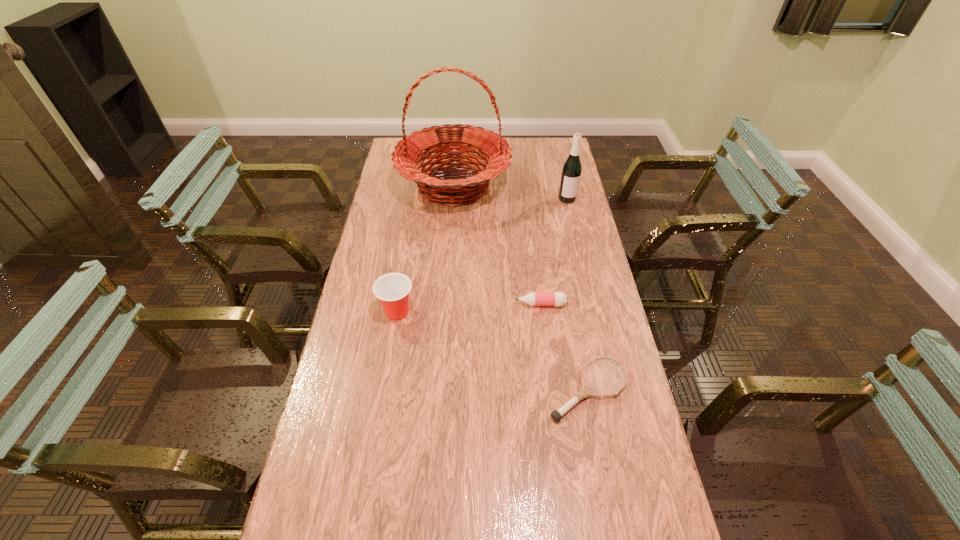
Where is `blank area located with the cap open on the bottle`? blank area located with the cap open on the bottle is located at coordinates (410, 304).

Identify the location of free space located 0.160m with the cap open on the bottle. The width and height of the screenshot is (960, 540). (466, 304).

In order to click on vacant area situated 0.390m on the left of the nearest object in this screenshot , I will do `click(404, 389)`.

Where is `object at the far edge`? The image size is (960, 540). object at the far edge is located at coordinates (436, 188).

I want to click on basket located in the left edge section of the desktop, so click(436, 188).

At what (x,y) coordinates should I click in order to perform the action: click on cup that is at the left edge. Please return your answer as a coordinate pair (x, y). The height and width of the screenshot is (540, 960). Looking at the image, I should click on (392, 289).

Locate an element on the screen. wine bottle that is at the right edge is located at coordinates (571, 172).

Locate an element on the screen. bottle at the right edge is located at coordinates (558, 299).

Image resolution: width=960 pixels, height=540 pixels. In order to click on tennis racket present at the right edge in this screenshot , I will do `click(585, 391)`.

Locate an element on the screen. object present at the far left corner is located at coordinates (436, 188).